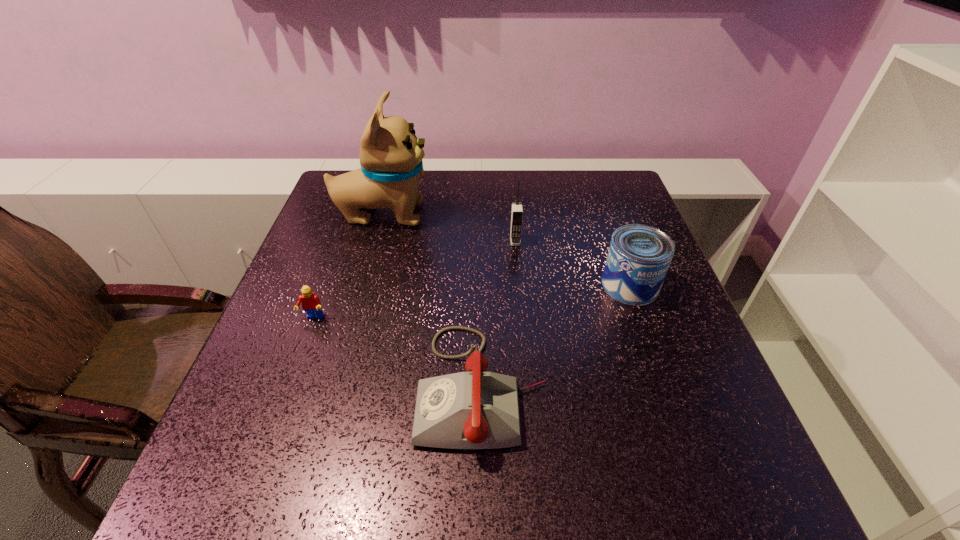
The width and height of the screenshot is (960, 540). I want to click on vacant region between the Lego and the puppy, so click(348, 266).

Where is `empty space that is in between the cellular telephone and the nearest object`? empty space that is in between the cellular telephone and the nearest object is located at coordinates (498, 314).

Find the location of a particular element. The width and height of the screenshot is (960, 540). vacant area between the nearest object and the second nearest object is located at coordinates (397, 352).

The image size is (960, 540). Identify the location of vacant area that lies between the fourth farthest object and the fourth nearest object. (414, 280).

Where is `free space between the cellular telephone and the second nearest object`? free space between the cellular telephone and the second nearest object is located at coordinates (414, 280).

This screenshot has width=960, height=540. What are the coordinates of `free space between the third tallest object and the second farthest object` in the screenshot? It's located at (572, 263).

Where is `object that is the closest one to the can`? object that is the closest one to the can is located at coordinates (476, 409).

The height and width of the screenshot is (540, 960). Identify the location of the closest object to the fourth nearest object. (639, 256).

Locate an element on the screen. This screenshot has height=540, width=960. vacant space that satisfies the following two spatial constraints: 1. on the front label of the third farthest object; 2. on the dial of the nearest object is located at coordinates (666, 386).

Identify the location of blank space that satisfies the following two spatial constraints: 1. on the front-facing side of the second tallest object; 2. on the dial of the telephone. (529, 386).